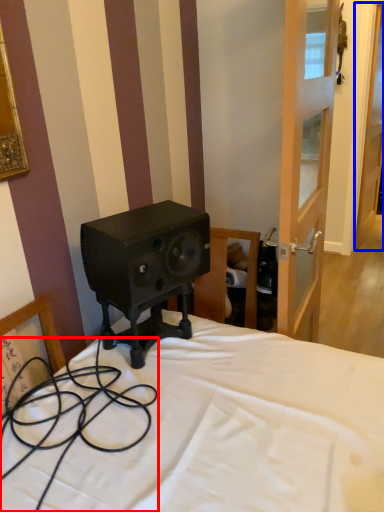
Question: Which object is closer to the camera taking this photo, cable (highlighted by a red box) or door (highlighted by a blue box)?

Choices:
 (A) cable
 (B) door

Answer: (A)